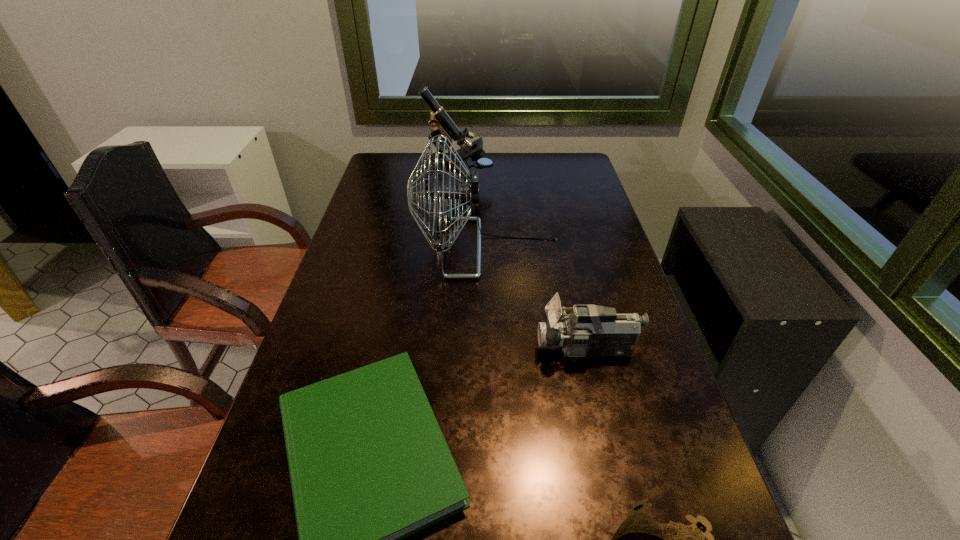
At what (x,y) coordinates should I click in order to perform the action: click on object present at the far edge. Please return your answer as a coordinate pair (x, y). Image resolution: width=960 pixels, height=540 pixels. Looking at the image, I should click on (440, 123).

Locate an element on the screen. The image size is (960, 540). object positioned at the right edge is located at coordinates (590, 330).

Where is `free location at the far edge`? This screenshot has height=540, width=960. free location at the far edge is located at coordinates (482, 172).

This screenshot has width=960, height=540. Find the location of `free region at the left edge`. free region at the left edge is located at coordinates tap(283, 519).

In the image, there is a desktop. In order to click on vacant space at the right edge in this screenshot , I will do `click(629, 386)`.

Where is `vacant region at the far left corner of the desktop`? This screenshot has width=960, height=540. vacant region at the far left corner of the desktop is located at coordinates (378, 156).

Find the location of `free region at the far right corner`. free region at the far right corner is located at coordinates (586, 172).

Locate an element on the screen. Image resolution: width=960 pixels, height=540 pixels. vacant region between the fan and the camcorder is located at coordinates (538, 299).

You are a GUI agent. You are given a task and a screenshot of the screen. Output one action in this format:
    pyautogui.click(x=<x>, y=<y>)
    Task: Click on the empty location between the fan and the microscope
    
    Given the screenshot: What is the action you would take?
    pyautogui.click(x=473, y=216)

Where is `object that is the third nearest to the shortest object`? The image size is (960, 540). object that is the third nearest to the shortest object is located at coordinates (468, 194).